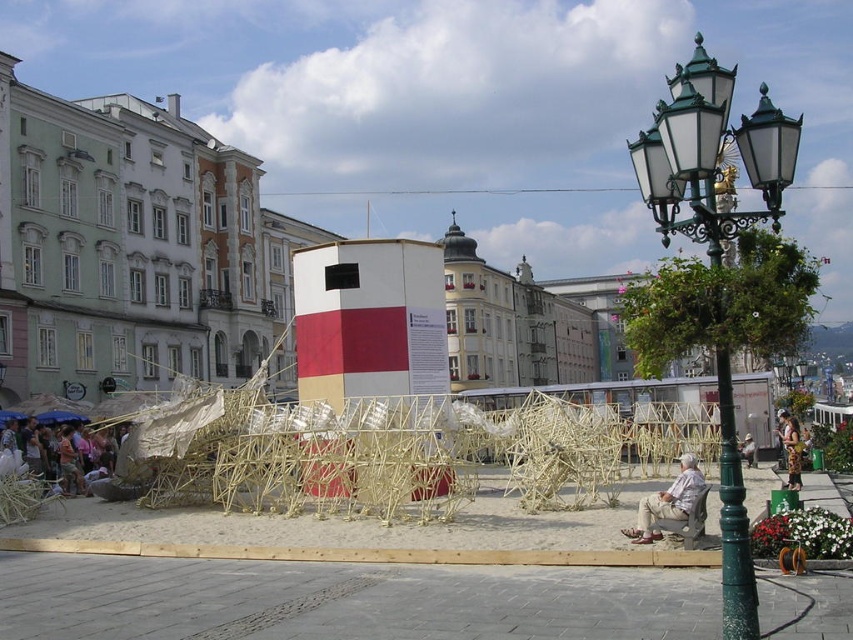
Question: Which is nearer to the beige fabric chair at lower right?

Choices:
 (A) light brown wooden bench at center
 (B) light brown fabric at lower left
 (C) green metal streetlight at right

Answer: (C)

Question: Based on their relative distances, which object is nearer to the beige fabric chair at lower right?

Choices:
 (A) light brown fabric at lower left
 (B) light brown wooden bench at center
 (C) green metal streetlight at right

Answer: (C)

Question: Which of the following is the farthest from the observer?

Choices:
 (A) green metal streetlight at right
 (B) beige fabric chair at lower right

Answer: (B)

Question: Is light brown fabric at lower left smaller than beige fabric chair at lower right?

Choices:
 (A) no
 (B) yes

Answer: (B)

Question: Is green metal streetlight at right positioned at the back of light brown fabric at lower left?

Choices:
 (A) yes
 (B) no

Answer: (B)

Question: Can you confirm if light brown fabric at lower left is positioned to the right of light brown wooden bench at center?

Choices:
 (A) yes
 (B) no

Answer: (B)